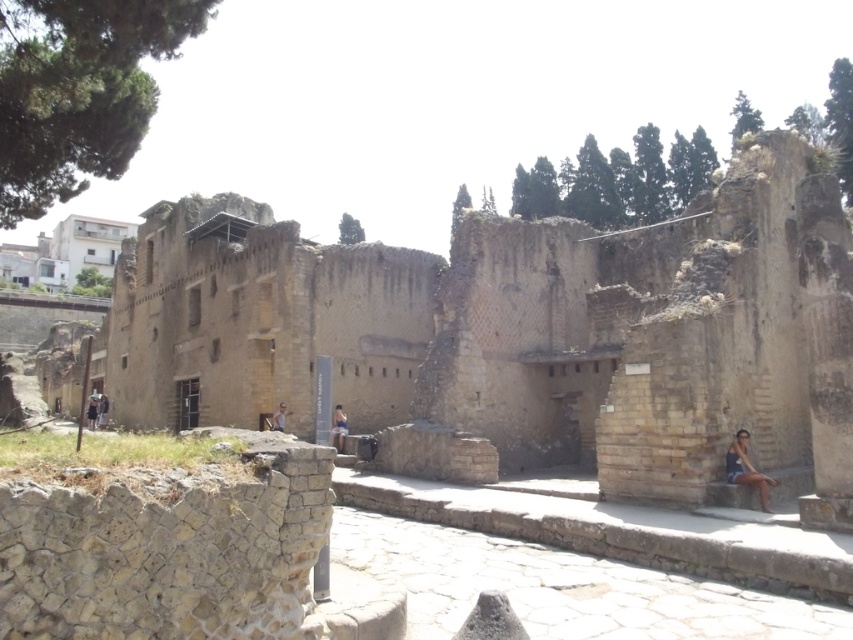
Question: Which point appears closest to the camera in this image?

Choices:
 (A) (339, 403)
 (B) (740, 456)

Answer: (B)

Question: Considering the relative positions of earthy stone ruins at center and dark brown leather jacket at center in the image provided, where is earthy stone ruins at center located with respect to dark brown leather jacket at center?

Choices:
 (A) left
 (B) right

Answer: (B)

Question: Based on their relative distances, which object is farther from the dark brown leather jacket at center?

Choices:
 (A) earthy stone ruins at center
 (B) light brown stone person at center
 (C) blue denim shorts at center

Answer: (C)

Question: Observing the image, what is the correct spatial positioning of blue denim shorts at center in reference to light brown stone person at center?

Choices:
 (A) left
 (B) right

Answer: (B)

Question: Does earthy stone ruins at center have a smaller size compared to dark brown leather jacket at center?

Choices:
 (A) yes
 (B) no

Answer: (B)

Question: Which of the following is the farthest from the observer?

Choices:
 (A) matte blue tank top at lower right
 (B) earthy stone ruins at center
 (C) blue denim shorts at center

Answer: (C)